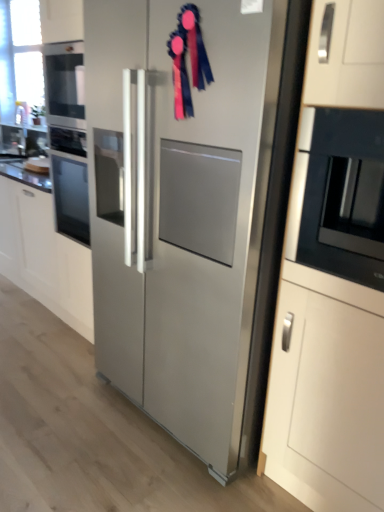
Question: Can you see black glossy microwave at right touching blue satin ribbon at upper center?

Choices:
 (A) yes
 (B) no

Answer: (B)

Question: From a real-world perspective, is black glossy microwave at right located beneath blue satin ribbon at upper center?

Choices:
 (A) no
 (B) yes

Answer: (B)

Question: Is black glossy microwave at right oriented away from blue satin ribbon at upper center?

Choices:
 (A) no
 (B) yes

Answer: (A)

Question: Considering the relative positions of black glossy microwave at right and blue satin ribbon at upper center in the image provided, is black glossy microwave at right behind blue satin ribbon at upper center?

Choices:
 (A) no
 (B) yes

Answer: (A)

Question: Does black glossy microwave at right have a lesser width compared to blue satin ribbon at upper center?

Choices:
 (A) no
 (B) yes

Answer: (A)

Question: Considering the relative positions of black glossy microwave at right and stainless steel refrigerator at center in the image provided, is black glossy microwave at right to the left or to the right of stainless steel refrigerator at center?

Choices:
 (A) right
 (B) left

Answer: (A)

Question: Looking at their shapes, would you say black glossy microwave at right is wider or thinner than stainless steel refrigerator at center?

Choices:
 (A) wide
 (B) thin

Answer: (B)

Question: Relative to stainless steel refrigerator at center, is black glossy microwave at right in front or behind?

Choices:
 (A) front
 (B) behind

Answer: (B)

Question: Would you say black glossy microwave at right is inside or outside stainless steel refrigerator at center?

Choices:
 (A) inside
 (B) outside

Answer: (B)

Question: Based on their positions, is brushed metal sink at left located to the left or right of satin white cabinet at center?

Choices:
 (A) right
 (B) left

Answer: (A)

Question: Considering the positions of brushed metal sink at left and satin white cabinet at center in the image, is brushed metal sink at left taller or shorter than satin white cabinet at center?

Choices:
 (A) tall
 (B) short

Answer: (B)

Question: Considering the positions of point (13, 147) and point (74, 314), is point (13, 147) closer or farther from the camera than point (74, 314)?

Choices:
 (A) farther
 (B) closer

Answer: (A)

Question: Looking at the image, does brushed metal sink at left seem bigger or smaller compared to satin white cabinet at center?

Choices:
 (A) big
 (B) small

Answer: (B)

Question: From a real-world perspective, relative to blue satin ribbon at upper center, is stainless steel refrigerator at center vertically above or below?

Choices:
 (A) below
 (B) above

Answer: (A)

Question: From the image's perspective, relative to blue satin ribbon at upper center, is stainless steel refrigerator at center above or below?

Choices:
 (A) below
 (B) above

Answer: (A)